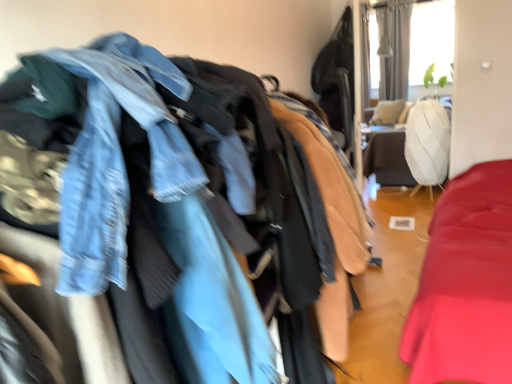
Question: Is white textured curtain at upper right positioned with its back to faded denim jacket at upper left?

Choices:
 (A) no
 (B) yes

Answer: (A)

Question: Is white textured curtain at upper right outside faded denim jacket at upper left?

Choices:
 (A) no
 (B) yes

Answer: (B)

Question: Does white textured curtain at upper right have a greater height compared to faded denim jacket at upper left?

Choices:
 (A) yes
 (B) no

Answer: (A)

Question: Is white textured curtain at upper right smaller than faded denim jacket at upper left?

Choices:
 (A) no
 (B) yes

Answer: (B)

Question: Is white textured curtain at upper right shorter than faded denim jacket at upper left?

Choices:
 (A) no
 (B) yes

Answer: (A)

Question: Does white textured curtain at upper right lie in front of faded denim jacket at upper left?

Choices:
 (A) no
 (B) yes

Answer: (A)

Question: Would you say faded denim jacket at upper left is a long distance from white textured curtain at upper right?

Choices:
 (A) no
 (B) yes

Answer: (B)

Question: From a real-world perspective, is faded denim jacket at upper left below white textured curtain at upper right?

Choices:
 (A) yes
 (B) no

Answer: (A)

Question: Is faded denim jacket at upper left touching white textured curtain at upper right?

Choices:
 (A) yes
 (B) no

Answer: (B)

Question: Can you confirm if faded denim jacket at upper left is wider than white textured curtain at upper right?

Choices:
 (A) no
 (B) yes

Answer: (B)

Question: Does faded denim jacket at upper left have a larger size compared to white textured curtain at upper right?

Choices:
 (A) yes
 (B) no

Answer: (A)

Question: From the image's perspective, is faded denim jacket at upper left above white textured curtain at upper right?

Choices:
 (A) yes
 (B) no

Answer: (B)

Question: From the image's perspective, is faded denim jacket at upper left above or below white textured curtain at upper right?

Choices:
 (A) below
 (B) above

Answer: (A)